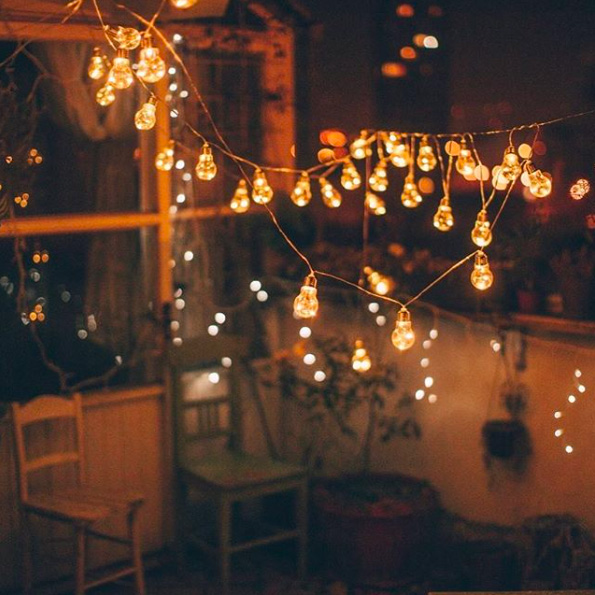
I want to click on pot, so click(x=369, y=549).